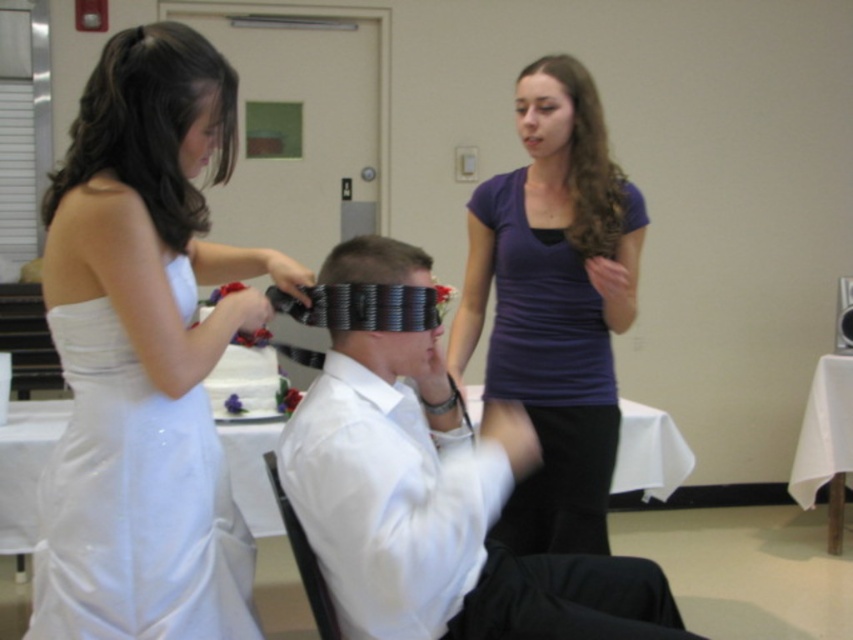
Describe the element at coordinates (439, 509) in the screenshot. I see `white glossy shirt at center` at that location.

Is point (351, 332) less distant than point (219, 56)?

No, (351, 332) is behind (219, 56).

The width and height of the screenshot is (853, 640). In order to click on white glossy shirt at center in this screenshot , I will do `click(439, 509)`.

Who is lower down, white glossy shirt at center or purple matte shirt at upper center?

white glossy shirt at center is lower down.

Does white glossy shirt at center have a greater width compared to purple matte shirt at upper center?

Correct, the width of white glossy shirt at center exceeds that of purple matte shirt at upper center.

Is point (660, 637) closer to camera compared to point (577, 234)?

Yes, point (660, 637) is in front of point (577, 234).

The height and width of the screenshot is (640, 853). I want to click on white glossy shirt at center, so point(439,509).

Between point (114, 499) and point (601, 220), which one is positioned in front?

Positioned in front is point (114, 499).

Is point (102, 522) in front of point (604, 154)?

Yes, point (102, 522) is closer to viewer.

Is point (142, 308) positioned after point (573, 106)?

No.

This screenshot has height=640, width=853. I want to click on white satin dress at left, so click(144, 353).